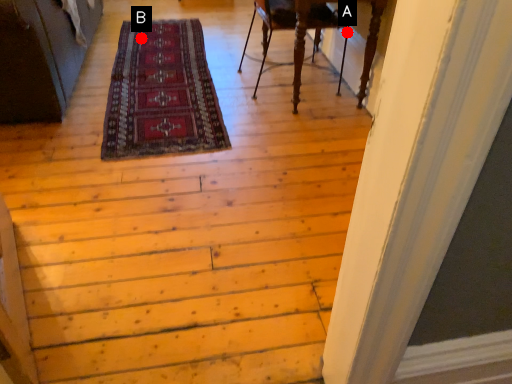
Question: Two points are circled on the image, labeled by A and B beside each circle. Which point is farther to the camera?

Choices:
 (A) A is further
 (B) B is further

Answer: (B)